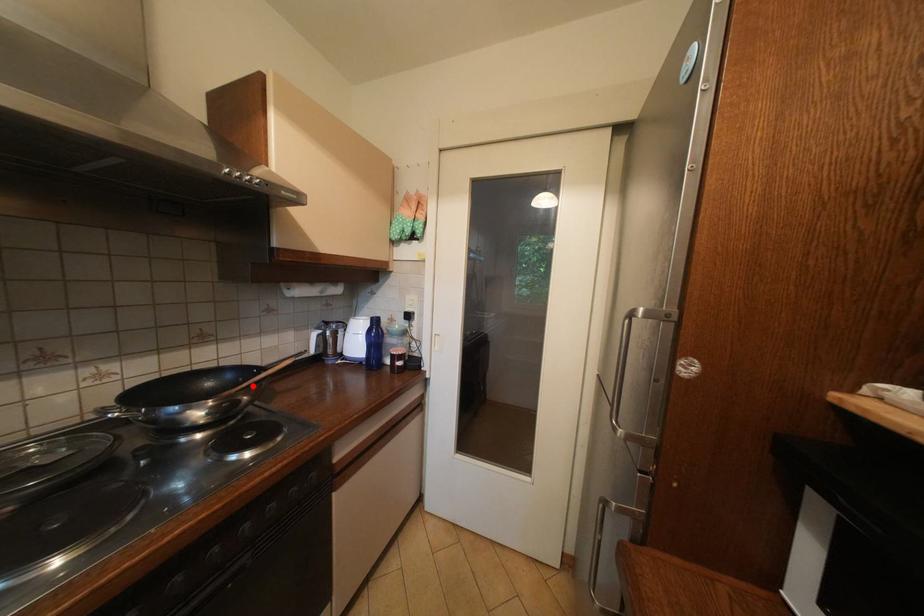
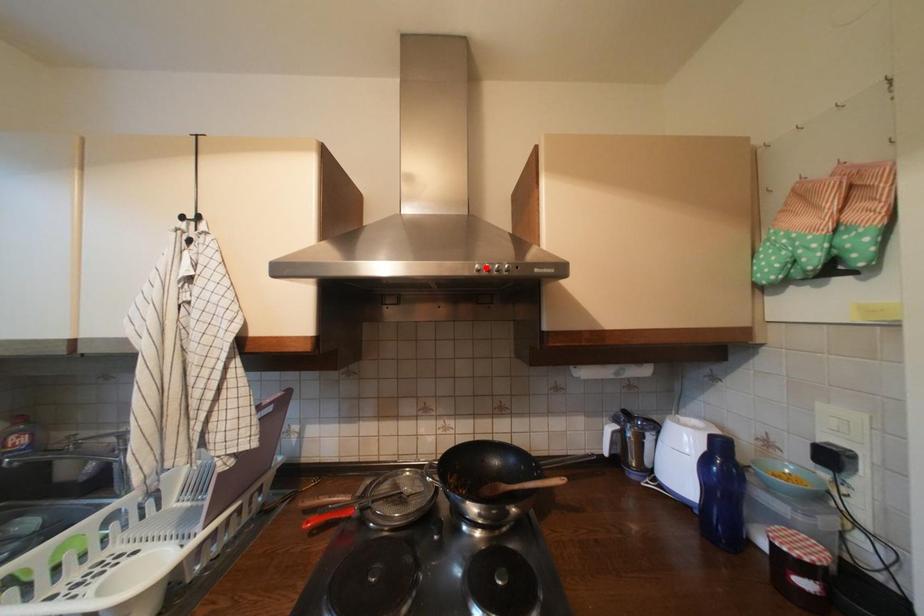
Looking at this image, I am providing you with two images of the same scene from different viewpoints. A red point is marked on the first image and another point is marked on the second image. Are the points marked in image1 and image2 representing the same 3D position?

No